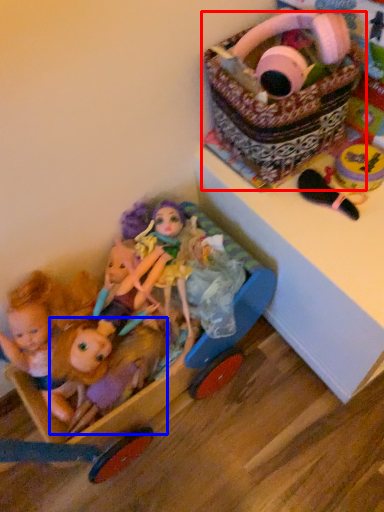
Question: Which of the following is the closest to the observer, basket (highlighted by a red box) or doll (highlighted by a blue box)?

Choices:
 (A) basket
 (B) doll

Answer: (A)